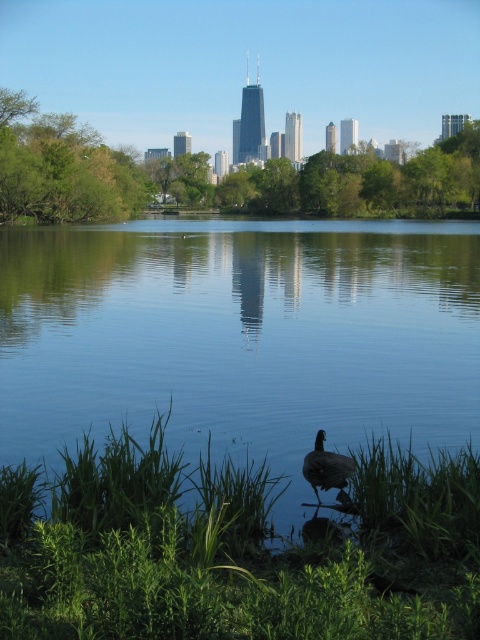
Question: Among these objects, which one is nearest to the camera?

Choices:
 (A) green leafy grass at lower center
 (B) brown feathered duck at lower center
 (C) blue smooth water at center

Answer: (A)

Question: Does green leafy grass at lower center lie behind brown feathered duck at lower center?

Choices:
 (A) no
 (B) yes

Answer: (A)

Question: Which point is farther from the camera taking this photo?

Choices:
 (A) (321, 461)
 (B) (427, 424)

Answer: (B)

Question: Which point is closer to the camera?

Choices:
 (A) (407, 573)
 (B) (367, 417)

Answer: (A)

Question: Is the position of blue smooth water at center less distant than that of brown feathered duck at lower center?

Choices:
 (A) no
 (B) yes

Answer: (A)

Question: Does blue smooth water at center appear on the left side of brown feathered duck at lower center?

Choices:
 (A) yes
 (B) no

Answer: (B)